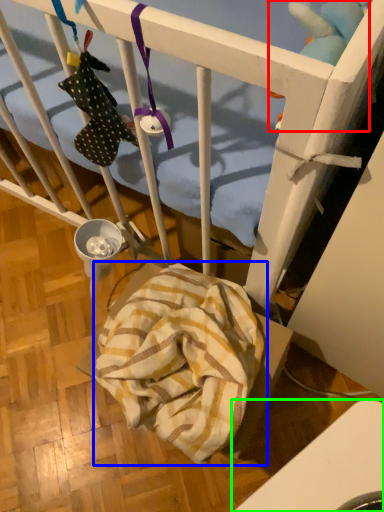
Question: Based on their relative distances, which object is farther from toy (highlighted by a red box)? Choose from blanket (highlighted by a blue box) and furniture (highlighted by a green box).

Choices:
 (A) blanket
 (B) furniture

Answer: (B)